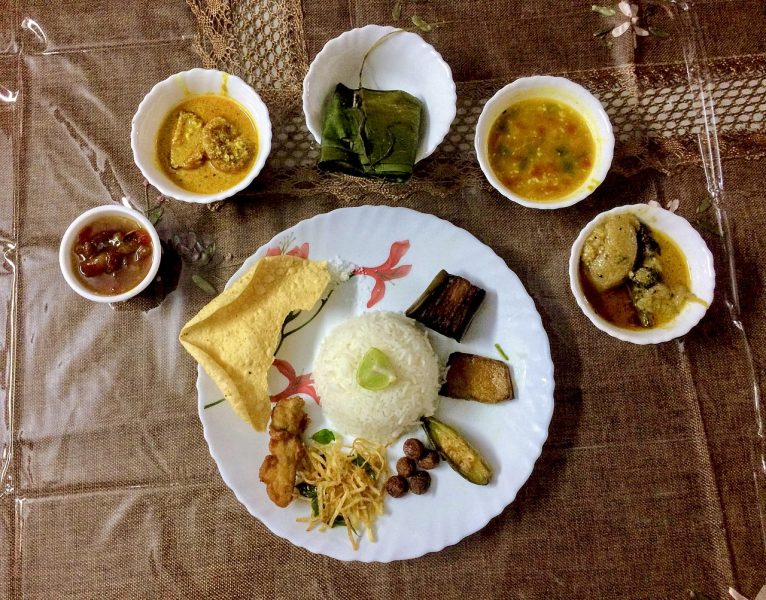
Find the location of a particular element. Image resolution: width=766 pixels, height=600 pixels. medium bowls is located at coordinates (574, 92), (184, 90), (686, 239).